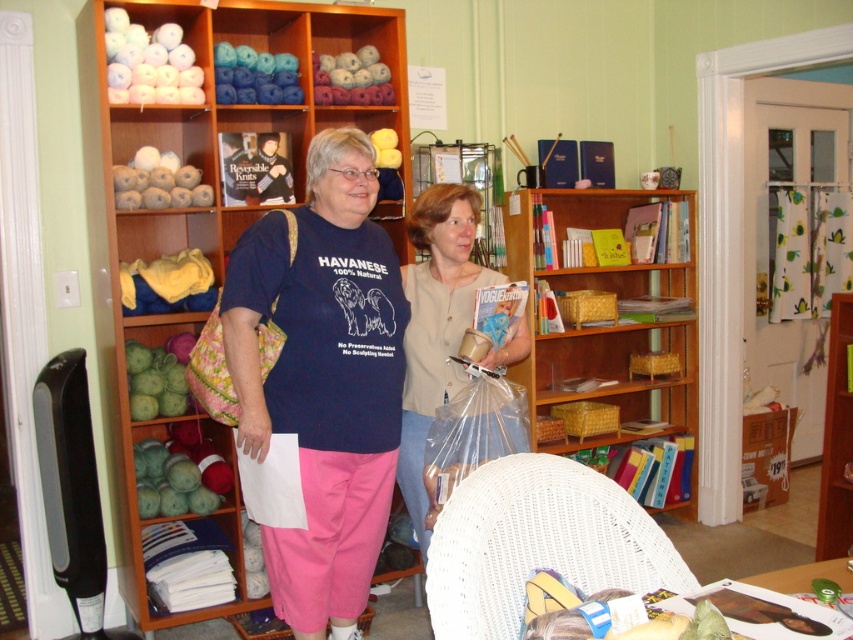
Question: Estimate the real-world distances between objects in this image. Which object is closer to the wooden bookcase at center?

Choices:
 (A) wooden bookshelf at right
 (B) matte blue t-shirt with dog print at center

Answer: (A)

Question: Which is farther from the floral fabric tote at center?

Choices:
 (A) matte blue t-shirt with dog print at center
 (B) wooden bookcase at center
 (C) beige fabric sweater at center
 (D) clear plastic bag at lower center

Answer: (B)

Question: Is matte blue t-shirt with dog print at center thinner than wooden bookshelf at right?

Choices:
 (A) yes
 (B) no

Answer: (B)

Question: Considering the real-world distances, which object is farthest from the wooden bookshelf at right?

Choices:
 (A) wooden bookshelf at left
 (B) matte blue t-shirt with dog print at center
 (C) beige fabric sweater at center
 (D) clear plastic bag at lower center

Answer: (A)

Question: Does beige fabric sweater at center have a greater width compared to wooden bookshelf at right?

Choices:
 (A) yes
 (B) no

Answer: (A)

Question: Does clear plastic bag at lower center have a smaller size compared to floral fabric tote at center?

Choices:
 (A) no
 (B) yes

Answer: (B)